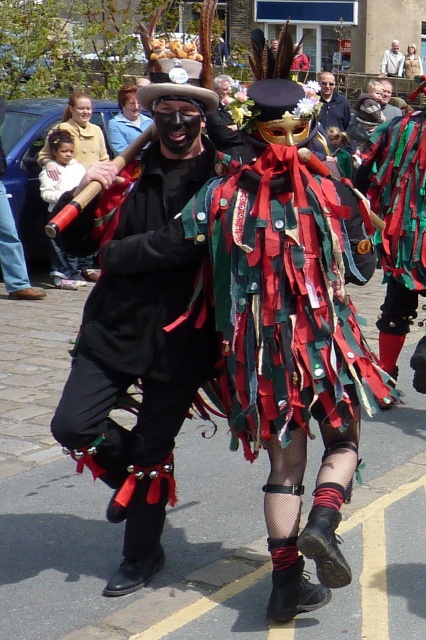
Which is more to the right, smooth blue shirt at center or white textured fabric at center?

white textured fabric at center

Is point (330, 120) in front of point (402, 61)?

Yes.

Who is more forward, [322,99] or [385,74]?

Positioned in front is point [322,99].

You are a GUI agent. You are given a task and a screenshot of the screen. Output one action in this format:
    pyautogui.click(x=<x>, y=<y>)
    Task: Click on the smooth blue shirt at center
    
    Given the screenshot: What is the action you would take?
    pyautogui.click(x=331, y=104)

Which is more to the right, red-green fabric strips at center or shiny metallic mask at center?

Positioned to the right is red-green fabric strips at center.

Describe the element at coordinates (284, 296) in the screenshot. I see `red-green fabric strips at center` at that location.

Who is more forward, (242,305) or (166,390)?

Point (242,305) is more forward.

Identify the location of red-green fabric strips at center. (284, 296).

How far apart are red-green fabric strips at center and smooth blue shirt at center?

red-green fabric strips at center is 9.29 meters away from smooth blue shirt at center.

Which of these two, red-green fabric strips at center or smooth blue shirt at center, stands taller?

smooth blue shirt at center is taller.

Does point (311, 224) lie in front of point (319, 109)?

Yes, it is in front of point (319, 109).

Image resolution: width=426 pixels, height=640 pixels. Find the location of `red-green fabric strips at center`. red-green fabric strips at center is located at coordinates (284, 296).